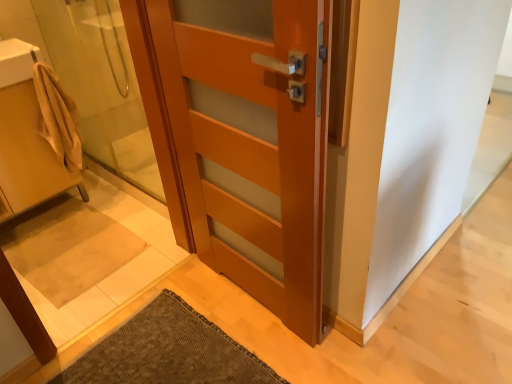
You are a GUI agent. You are given a task and a screenshot of the screen. Output one action in this format:
    pyautogui.click(x=<x>, y=<y>)
    Task: Click on the vacant space underneath matte wood door at center (from a real-world perspective)
    The height and width of the screenshot is (384, 512).
    Given the screenshot: What is the action you would take?
    pyautogui.click(x=254, y=305)